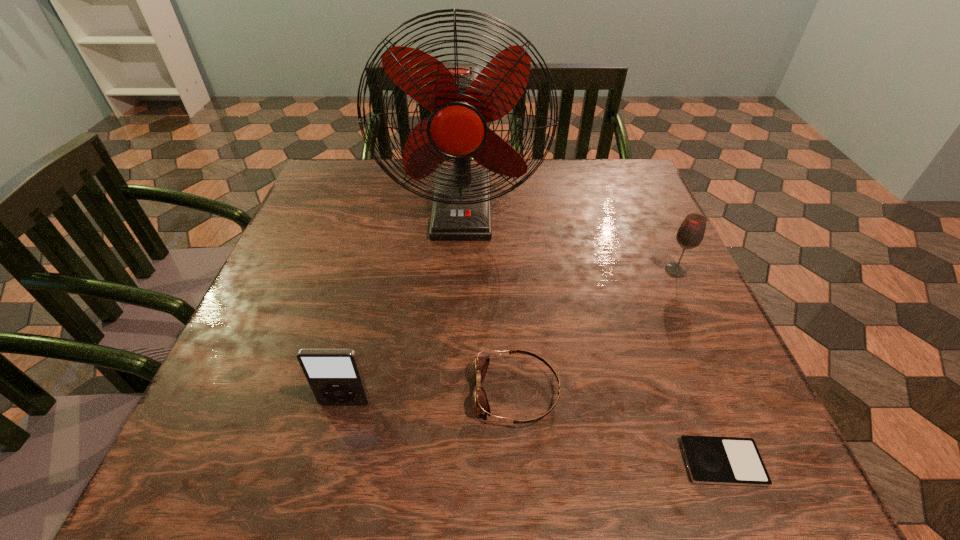
Locate an element on the screen. Image resolution: width=960 pixels, height=540 pixels. free region located on the left of the glass drink container is located at coordinates (602, 271).

This screenshot has height=540, width=960. Identify the location of free space located 0.190m through the lenses of the goggles. (355, 392).

In order to click on free space located through the lenses of the goggles in this screenshot , I will do `click(250, 392)`.

I want to click on vacant space located through the lenses of the goggles, so click(294, 392).

This screenshot has width=960, height=540. In order to click on free space located 0.360m on the back of the right iPod in this screenshot , I will do `click(647, 272)`.

You are a GUI agent. You are given a task and a screenshot of the screen. Output one action in this format:
    pyautogui.click(x=<x>, y=<y>)
    Task: Click on the object that is at the far edge
    
    Given the screenshot: What is the action you would take?
    pyautogui.click(x=462, y=99)

Find the location of `goggles that is at the near edge`. goggles that is at the near edge is located at coordinates [481, 405].

Identify the location of iPod at the near edge. The height and width of the screenshot is (540, 960). (710, 460).

Image resolution: width=960 pixels, height=540 pixels. I want to click on glass drink container present at the right edge, so click(690, 234).

Identify the location of iPod that is at the right edge. (710, 460).